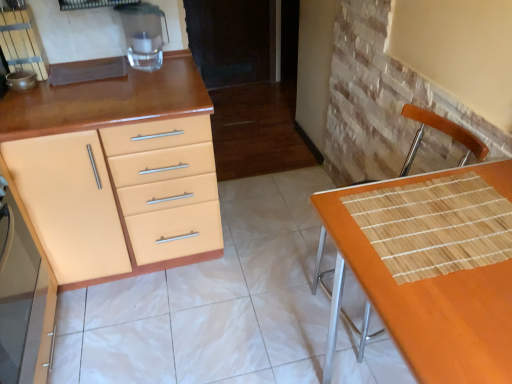
Where is `free location above orange woven mat at lower right (from a real-world perspective)`? The width and height of the screenshot is (512, 384). free location above orange woven mat at lower right (from a real-world perspective) is located at coordinates (445, 240).